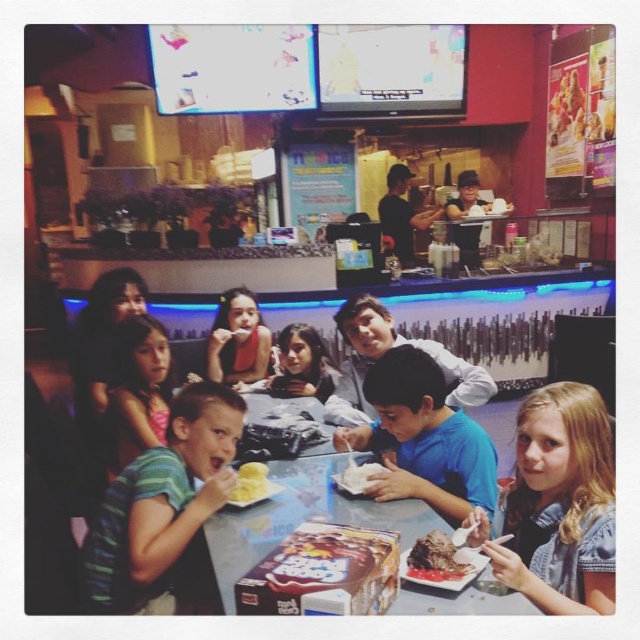
Is white paper plate at center below matte black hair at center?

Indeed, white paper plate at center is positioned under matte black hair at center.

Based on the photo, who is taller, white paper plate at center or matte black hair at center?

matte black hair at center

Identify the location of white paper plate at center. (301, 518).

The height and width of the screenshot is (640, 640). In order to click on white paper plate at center in this screenshot , I will do `click(301, 518)`.

Who is more distant from viewer, [582,449] or [340,486]?

Point [340,486]

Can you confirm if light brown hair at lower right is positioned above white fluffy cake at lower center?

Correct, light brown hair at lower right is located above white fluffy cake at lower center.

Which is in front, point (513, 547) or point (348, 474)?

Point (513, 547) is in front.

This screenshot has width=640, height=640. In order to click on light brown hair at lower right in this screenshot , I will do `click(557, 504)`.

Does white paper plate at center have a greater width compared to matte black shirt at upper center?

Correct, the width of white paper plate at center exceeds that of matte black shirt at upper center.

Is white paper plate at center behind matte black shirt at upper center?

No, white paper plate at center is closer to the viewer.

Does point (234, 604) lie in front of point (454, 240)?

That is True.

This screenshot has width=640, height=640. What are the coordinates of `white paper plate at center` in the screenshot? It's located at (301, 518).